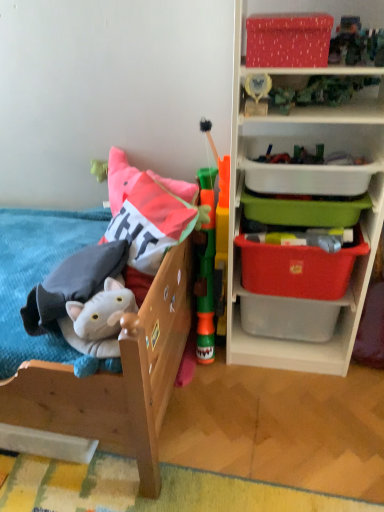
Question: From a real-world perspective, does wooden bed at left stand above red plastic storage box at right, which is counted as the second storage box, starting from the bottom?

Choices:
 (A) yes
 (B) no

Answer: (B)

Question: Does wooden bed at left have a lesser height compared to red plastic storage box at right, which is counted as the second storage box, starting from the bottom?

Choices:
 (A) no
 (B) yes

Answer: (A)

Question: Is wooden bed at left facing away from red plastic storage box at right, which is counted as the second storage box, starting from the bottom?

Choices:
 (A) no
 (B) yes

Answer: (A)

Question: Is the position of wooden bed at left more distant than that of red plastic storage box at right, the fourth storage box in the top-to-bottom sequence?

Choices:
 (A) yes
 (B) no

Answer: (B)

Question: Is wooden bed at left to the right of red plastic storage box at right, the fourth storage box in the top-to-bottom sequence, from the viewer's perspective?

Choices:
 (A) yes
 (B) no

Answer: (B)

Question: From a real-world perspective, does wooden bed at left sit lower than red plastic storage box at right, the fourth storage box in the top-to-bottom sequence?

Choices:
 (A) no
 (B) yes

Answer: (B)

Question: Is wooden bed at left not close to green plastic tower at center, positioned as the 1th toy in right-to-left order?

Choices:
 (A) no
 (B) yes

Answer: (A)

Question: From a real-world perspective, is wooden bed at left positioned under green plastic tower at center, positioned as the 1th toy in right-to-left order, based on gravity?

Choices:
 (A) yes
 (B) no

Answer: (B)

Question: Is wooden bed at left thinner than green plastic tower at center, which ranks as the 2th toy in left-to-right order?

Choices:
 (A) yes
 (B) no

Answer: (B)

Question: Is wooden bed at left outside of green plastic tower at center, which ranks as the 2th toy in left-to-right order?

Choices:
 (A) no
 (B) yes

Answer: (B)

Question: From the image's perspective, is wooden bed at left on top of green plastic tower at center, positioned as the 1th toy in right-to-left order?

Choices:
 (A) no
 (B) yes

Answer: (A)

Question: Is the position of wooden bed at left less distant than that of green plastic tower at center, positioned as the 1th toy in right-to-left order?

Choices:
 (A) no
 (B) yes

Answer: (B)

Question: Is the surface of plastic storage bins at right in direct contact with white plastic container at upper right, which ranks as the 2th storage box in top-to-bottom order?

Choices:
 (A) yes
 (B) no

Answer: (B)